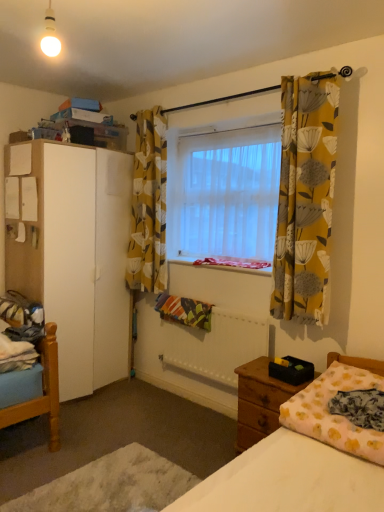
Question: From a real-world perspective, is translucent fabric window at center physically located above or below white fabric bed at lower right?

Choices:
 (A) below
 (B) above

Answer: (B)

Question: In terms of size, does translucent fabric window at center appear bigger or smaller than white fabric bed at lower right?

Choices:
 (A) big
 (B) small

Answer: (A)

Question: Which object is positioned closest to the white fabric bed at lower right?

Choices:
 (A) pink floral blanket at lower right
 (B) white fabric at center
 (C) blue cotton sheet at lower left
 (D) yellow floral fabric curtain at upper center, the second curtain viewed from the front
 (E) yellow floral fabric curtain at right, the first curtain positioned from the front

Answer: (A)

Question: Which object is the farthest from the wooden nightstand at lower right?

Choices:
 (A) white glossy bulb at upper left
 (B) white fabric bed at lower right
 (C) pink floral blanket at lower right
 (D) yellow floral fabric curtain at upper center, the 2th curtain from the right
 (E) white fabric mattress at lower right

Answer: (A)